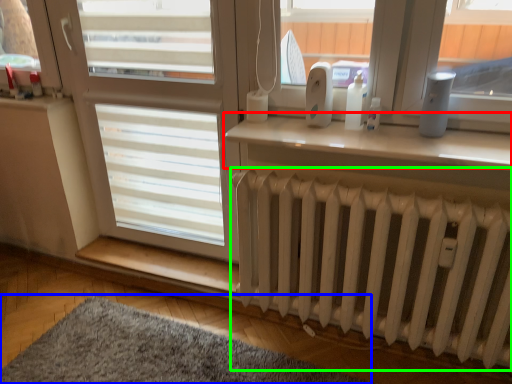
Question: Estimate the real-world distances between objects in this image. Which object is closer to window (highlighted by a red box), mat (highlighted by a blue box) or radiator (highlighted by a green box)?

Choices:
 (A) mat
 (B) radiator

Answer: (B)